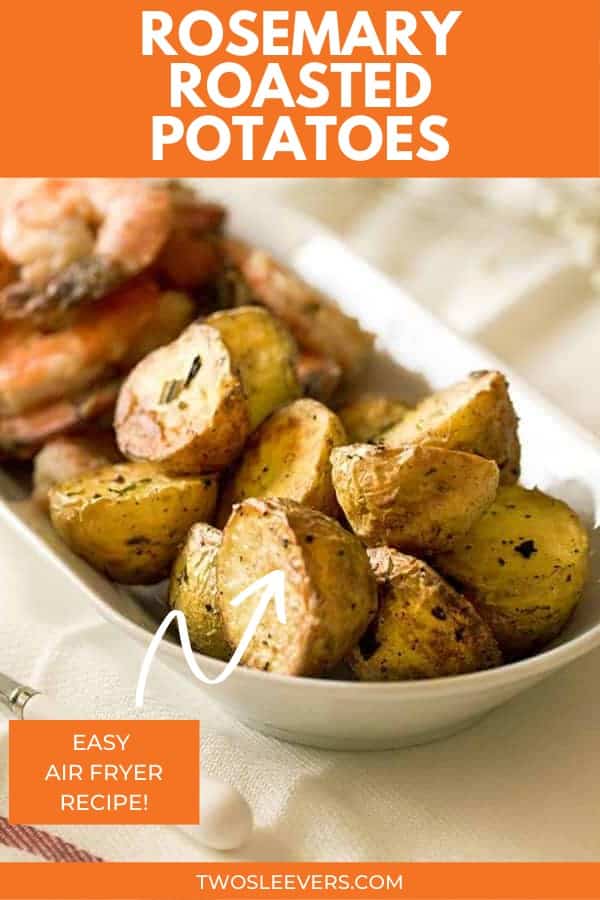
Where is `utensil`? This screenshot has height=900, width=600. utensil is located at coordinates (29, 706).